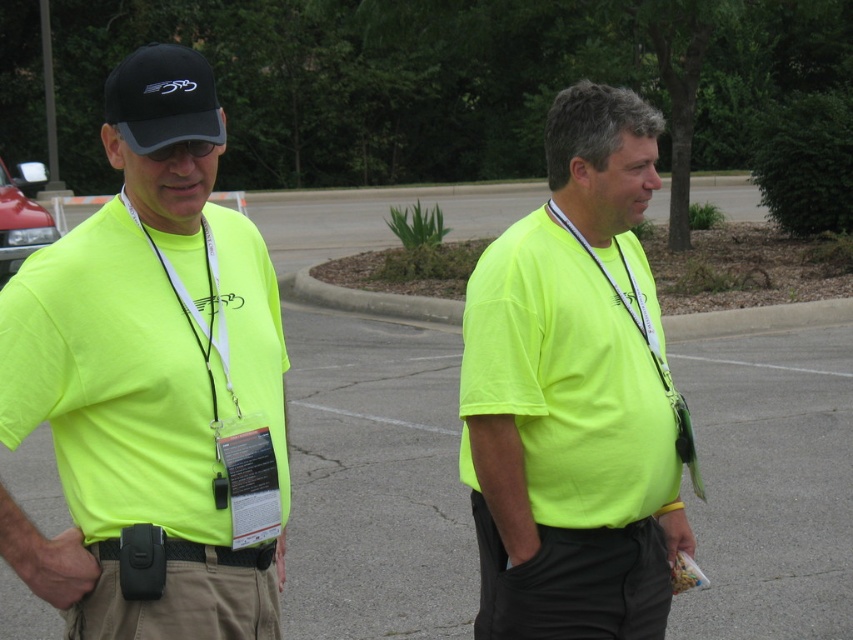
From the picture: Does neon yellow t-shirt at left have a greater width compared to khaki cotton pants at center?

Correct, the width of neon yellow t-shirt at left exceeds that of khaki cotton pants at center.

Based on the photo, who is higher up, neon yellow t-shirt at left or khaki cotton pants at center?

Positioned higher is neon yellow t-shirt at left.

Find the location of a particular element. neon yellow t-shirt at left is located at coordinates (154, 385).

Does neon yellow t-shirt at center appear on the right side of black fabric baseball cap at upper left?

Indeed, neon yellow t-shirt at center is positioned on the right side of black fabric baseball cap at upper left.

From the picture: Is neon yellow t-shirt at center above black fabric baseball cap at upper left?

No, neon yellow t-shirt at center is not above black fabric baseball cap at upper left.

Identify the location of neon yellow t-shirt at center. (573, 394).

Is point (209, 588) farther from camera compared to point (163, 125)?

Yes, point (209, 588) is behind point (163, 125).

Can you confirm if khaki cotton pants at center is wider than black fabric baseball cap at upper left?

In fact, khaki cotton pants at center might be narrower than black fabric baseball cap at upper left.

The width and height of the screenshot is (853, 640). I want to click on khaki cotton pants at center, so coord(184,596).